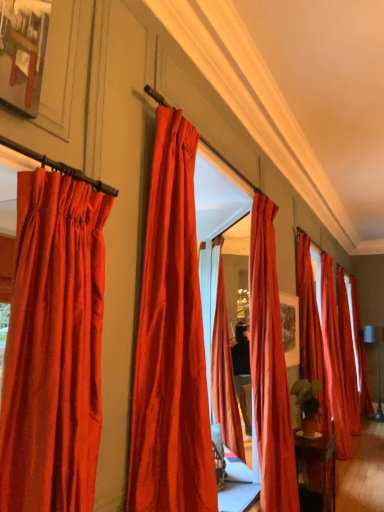
Question: Is satin red curtain at center, which appears as the fifth curtain when viewed from the right, far away from satin red curtain at right, which is counted as the 3th curtain, starting from the right?

Choices:
 (A) yes
 (B) no

Answer: (A)

Question: From a real-world perspective, is satin red curtain at center, which ranks as the 3th curtain in left-to-right order, on top of satin red curtain at right, marked as the fifth curtain in a front-to-back arrangement?

Choices:
 (A) no
 (B) yes

Answer: (B)

Question: Does satin red curtain at center, positioned as the 3th curtain in front-to-back order, have a larger size compared to satin red curtain at right, the fifth curtain from the left?

Choices:
 (A) yes
 (B) no

Answer: (A)

Question: Considering the relative sizes of satin red curtain at center, which appears as the fifth curtain when viewed from the right, and satin red curtain at right, the fifth curtain from the left, in the image provided, is satin red curtain at center, which appears as the fifth curtain when viewed from the right, wider than satin red curtain at right, the fifth curtain from the left,?

Choices:
 (A) no
 (B) yes

Answer: (A)

Question: Can you confirm if satin red curtain at center, which appears as the fifth curtain when viewed from the right, is taller than satin red curtain at right, marked as the fifth curtain in a front-to-back arrangement?

Choices:
 (A) yes
 (B) no

Answer: (B)

Question: From the image's perspective, is satin red curtain at right, acting as the fourth curtain starting from the right, positioned above or below satin red curtain at center, which appears as the fifth curtain when viewed from the right?

Choices:
 (A) below
 (B) above

Answer: (A)

Question: Relative to satin red curtain at center, positioned as the 3th curtain in front-to-back order, is satin red curtain at right, which is counted as the fourth curtain, starting from the left, in front or behind?

Choices:
 (A) front
 (B) behind

Answer: (B)

Question: Considering the positions of satin red curtain at right, the 4th curtain when ordered from front to back, and satin red curtain at center, which ranks as the 3th curtain in left-to-right order, in the image, is satin red curtain at right, the 4th curtain when ordered from front to back, wider or thinner than satin red curtain at center, which ranks as the 3th curtain in left-to-right order,?

Choices:
 (A) thin
 (B) wide

Answer: (B)

Question: Is satin red curtain at right, which is counted as the fourth curtain, starting from the left, taller or shorter than satin red curtain at center, the fifth curtain positioned from the back?

Choices:
 (A) tall
 (B) short

Answer: (A)

Question: Is satin red curtain at right, acting as the fourth curtain starting from the right, wider or thinner than satin red curtain at right, which is counted as the 3th curtain, starting from the right?

Choices:
 (A) wide
 (B) thin

Answer: (A)

Question: Considering the positions of satin red curtain at right, acting as the fourth curtain starting from the right, and satin red curtain at right, the 3th curtain positioned from the back, in the image, is satin red curtain at right, acting as the fourth curtain starting from the right, bigger or smaller than satin red curtain at right, the 3th curtain positioned from the back,?

Choices:
 (A) big
 (B) small

Answer: (A)

Question: From the image's perspective, relative to satin red curtain at right, the fifth curtain from the left, is satin red curtain at right, which is the fourth curtain from back to front, above or below?

Choices:
 (A) above
 (B) below

Answer: (A)

Question: Based on their positions, is satin red curtain at right, which is the fourth curtain from back to front, located to the left or right of satin red curtain at right, the 3th curtain positioned from the back?

Choices:
 (A) right
 (B) left

Answer: (B)

Question: From their relative heights in the image, would you say satin red curtain at left, placed as the seventh curtain when sorted from back to front, is taller or shorter than satin red curtain at center, the fifth curtain positioned from the back?

Choices:
 (A) tall
 (B) short

Answer: (B)

Question: In the image, is satin red curtain at left, the 1th curtain in the left-to-right sequence, positioned in front of or behind satin red curtain at center, which ranks as the 3th curtain in left-to-right order?

Choices:
 (A) front
 (B) behind

Answer: (A)